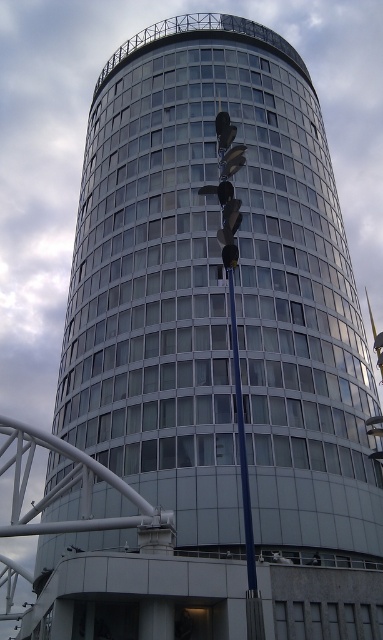
Is point (245, 480) positioned before point (314, 556)?

Yes, it is in front of point (314, 556).

Can you confirm if blue metallic pole at center is wider than dark blue fabric mannequin at center?

No, blue metallic pole at center is not wider than dark blue fabric mannequin at center.

Is point (235, 397) positioned before point (315, 557)?

No, it is not.

Locate an element on the screen. blue metallic pole at center is located at coordinates (242, 444).